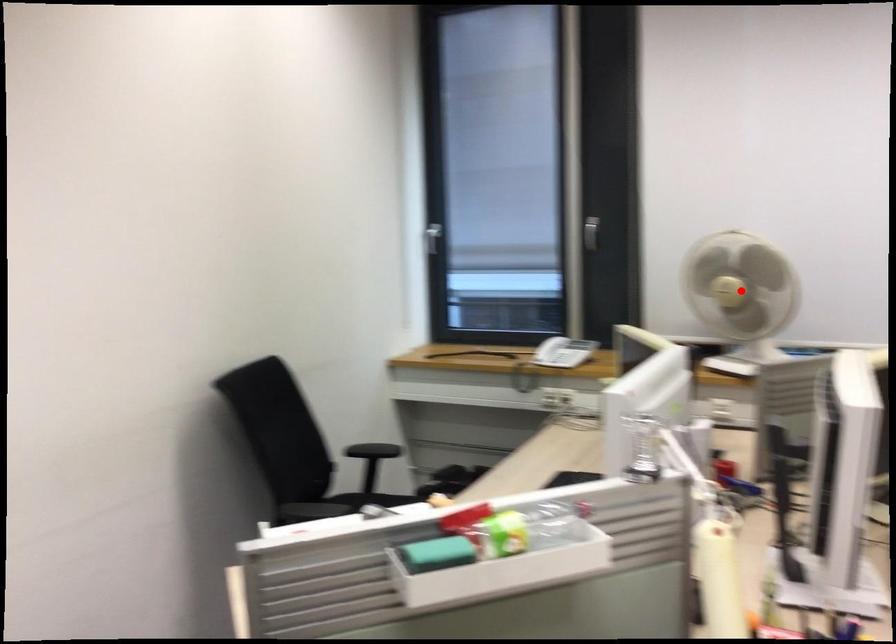
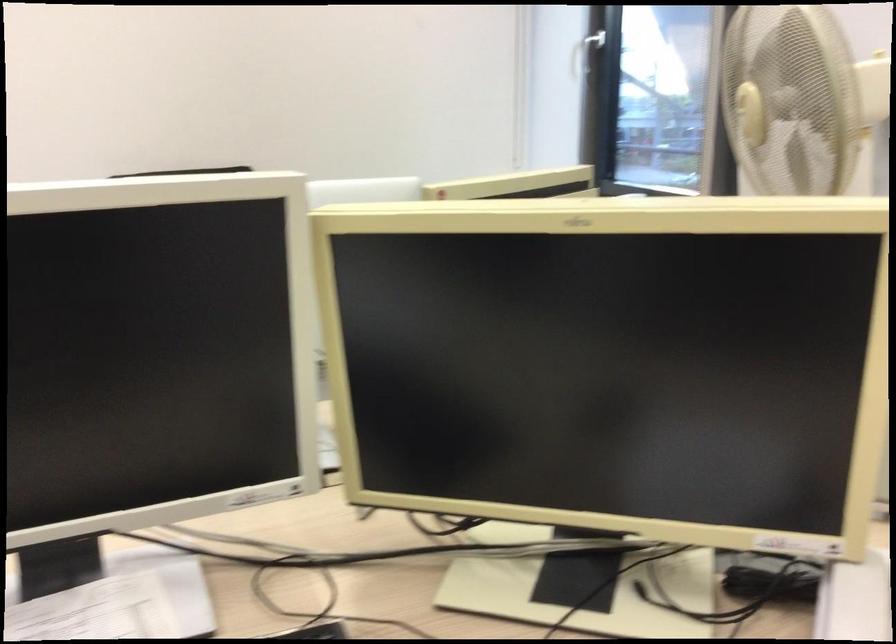
Question: I am providing you with two images of the same scene from different viewpoints. A red point is marked on the first image. At the location where the point appears in image 1, is it still visible in image 2?

Choices:
 (A) Yes
 (B) No

Answer: (B)